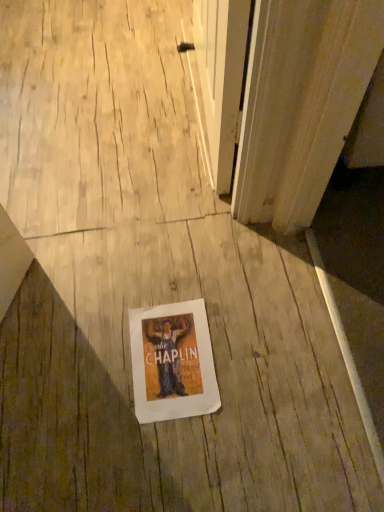
Find the location of a particular element. This screenshot has width=384, height=512. empty space that is ontop of white paper postcard at center (from a real-world perspective) is located at coordinates (172, 360).